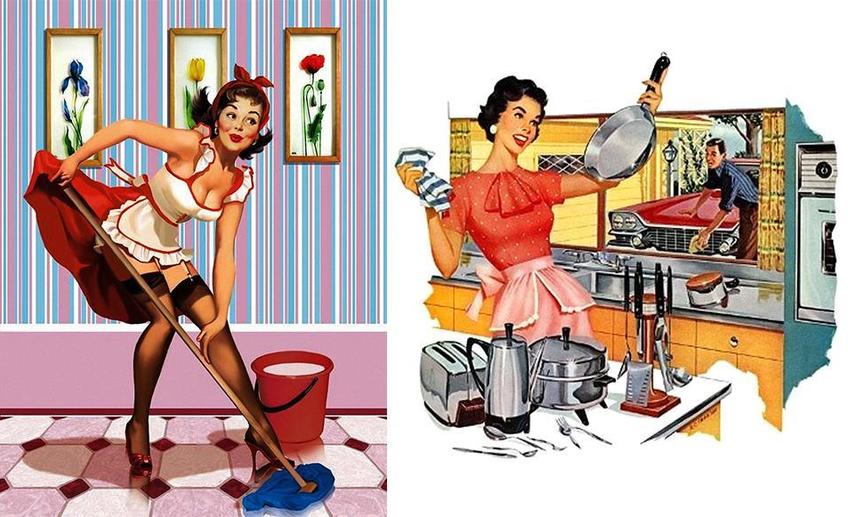
This screenshot has width=848, height=517. What are the coordinates of `stockings` in the screenshot? It's located at (194, 288), (159, 286).